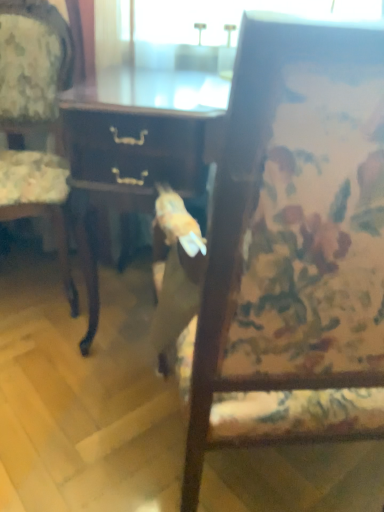
What are the coordinates of `vacant space situated above wooden desk at center (from a real-world perspective)` in the screenshot? It's located at (152, 80).